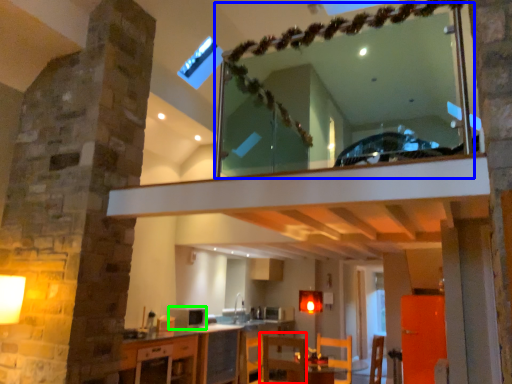
Question: Considering the real-world distances, which object is closest to armchair (highlighted by a red box)? mirror (highlighted by a blue box) or appliance (highlighted by a green box).

Choices:
 (A) mirror
 (B) appliance

Answer: (B)